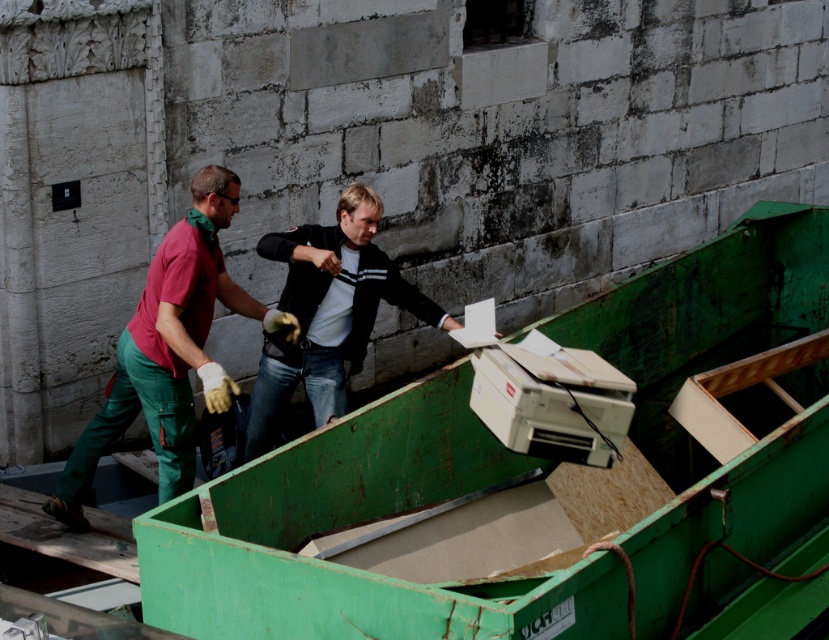
Is point (219, 371) closer to camera compared to point (279, 420)?

Yes, point (219, 371) is closer to viewer.

Describe the element at coordinates (168, 349) in the screenshot. I see `matte green jumpsuit at center` at that location.

The width and height of the screenshot is (829, 640). I want to click on matte green jumpsuit at center, so 168,349.